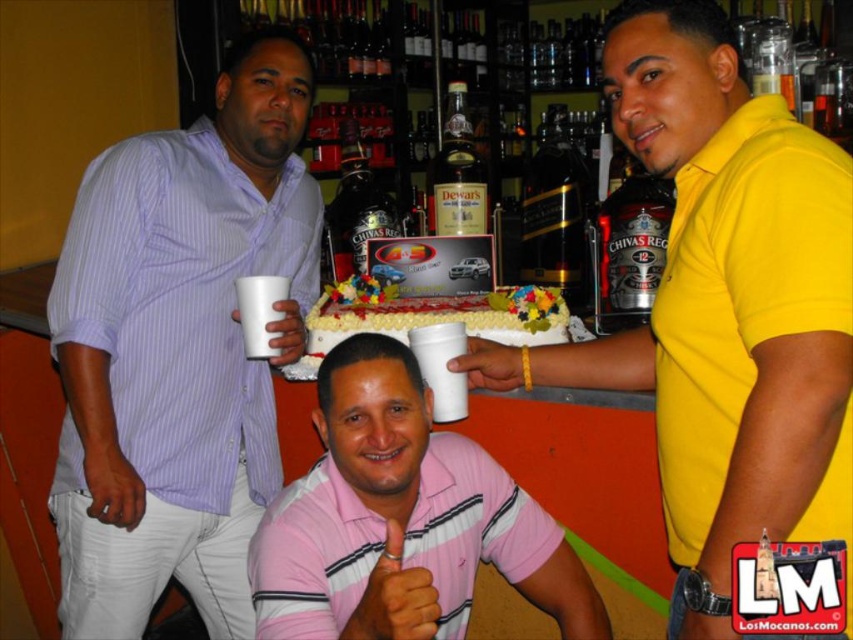
Who is more forward, (149, 346) or (755, 244)?

Point (755, 244)

At what (x,y) coordinates should I click in order to perform the action: click on purple striped shirt at upper left. Please return your answer as a coordinate pair (x, y). The width and height of the screenshot is (853, 640). Looking at the image, I should click on (178, 348).

This screenshot has width=853, height=640. In order to click on purple striped shirt at upper left in this screenshot , I will do `click(178, 348)`.

Which is in front, point (544, 330) or point (267, 339)?

Point (267, 339) is in front.

Is point (537, 323) farther from camera compared to point (259, 276)?

Yes, point (537, 323) is farther from viewer.

Who is more forward, (407, 316) or (245, 291)?

Point (245, 291)

Identify the location of white frosted cake at center. click(x=444, y=317).

Does point (299, 180) come farther from viewer compared to point (274, 353)?

Yes, point (299, 180) is farther from viewer.

Does point (195, 230) come behind point (247, 316)?

Yes, point (195, 230) is behind point (247, 316).

Locate an element on the screen. purple striped shirt at upper left is located at coordinates (178, 348).